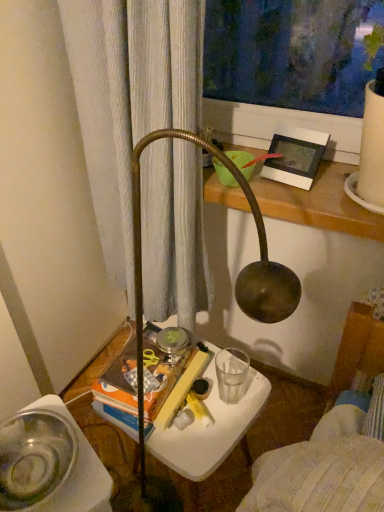
Question: Can you confirm if white plastic picture frame at upper right is positioned to the left of clear glass water at lower center?

Choices:
 (A) no
 (B) yes

Answer: (A)

Question: Is clear glass water at lower center inside white plastic picture frame at upper right?

Choices:
 (A) yes
 (B) no

Answer: (B)

Question: Does white plastic picture frame at upper right have a greater width compared to clear glass water at lower center?

Choices:
 (A) no
 (B) yes

Answer: (A)

Question: Is white plastic picture frame at upper right located outside clear glass water at lower center?

Choices:
 (A) no
 (B) yes

Answer: (B)

Question: Does white plastic picture frame at upper right have a lesser height compared to clear glass water at lower center?

Choices:
 (A) yes
 (B) no

Answer: (B)

Question: Considering their positions, is clear glass water at lower center located in front of or behind metallic silver bowl at lower left?

Choices:
 (A) behind
 (B) front

Answer: (A)

Question: Visually, is clear glass water at lower center positioned to the left or to the right of metallic silver bowl at lower left?

Choices:
 (A) right
 (B) left

Answer: (A)

Question: From the image's perspective, relative to metallic silver bowl at lower left, is clear glass water at lower center above or below?

Choices:
 (A) below
 (B) above

Answer: (B)

Question: Considering the positions of clear glass water at lower center and metallic silver bowl at lower left in the image, is clear glass water at lower center bigger or smaller than metallic silver bowl at lower left?

Choices:
 (A) small
 (B) big

Answer: (A)

Question: From a real-world perspective, is clear glass water at lower center physically located above or below white plastic table at center?

Choices:
 (A) below
 (B) above

Answer: (B)

Question: In the image, is clear glass water at lower center positioned in front of or behind white plastic table at center?

Choices:
 (A) front
 (B) behind

Answer: (B)

Question: Is clear glass water at lower center wider or thinner than white plastic table at center?

Choices:
 (A) thin
 (B) wide

Answer: (A)

Question: From the image's perspective, relative to white plastic table at center, is clear glass water at lower center above or below?

Choices:
 (A) below
 (B) above

Answer: (B)

Question: Is white plastic picture frame at upper right inside the boundaries of white plastic table at center, or outside?

Choices:
 (A) outside
 (B) inside

Answer: (A)

Question: Looking at the image, does white plastic picture frame at upper right seem bigger or smaller compared to white plastic table at center?

Choices:
 (A) big
 (B) small

Answer: (B)